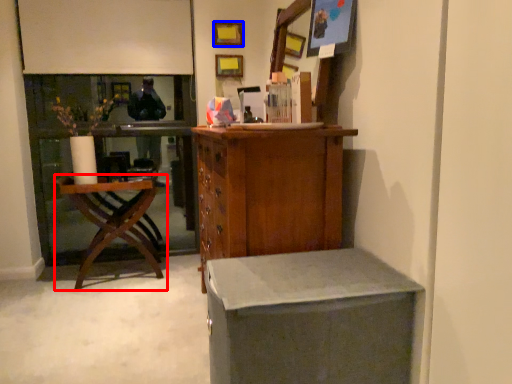
Question: Which object is closer to the camera taking this photo, chair (highlighted by a red box) or picture frame (highlighted by a blue box)?

Choices:
 (A) chair
 (B) picture frame

Answer: (A)